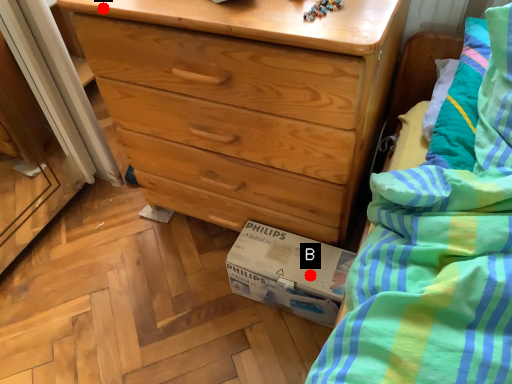
Question: Two points are circled on the image, labeled by A and B beside each circle. Which point is closer to the camera?

Choices:
 (A) A is closer
 (B) B is closer

Answer: (A)